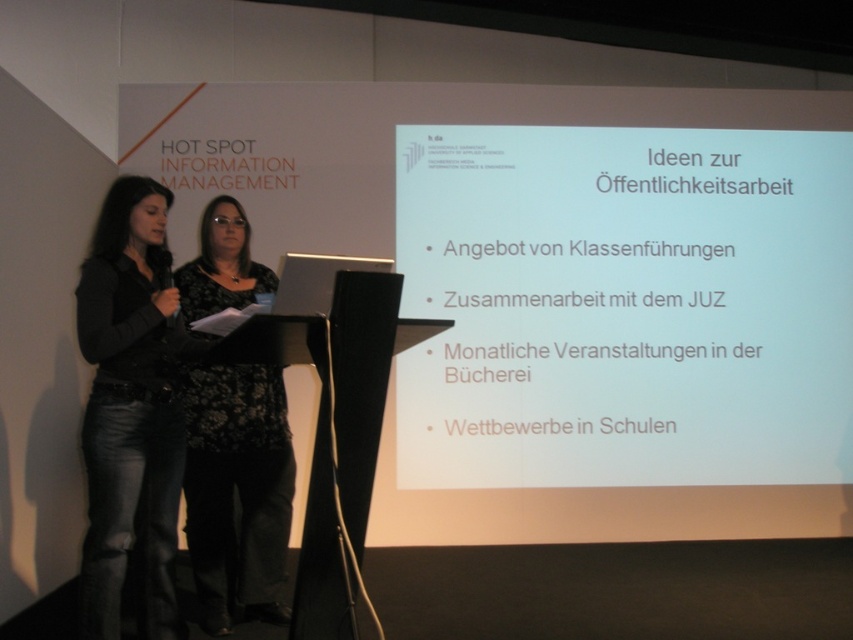
Question: From the image, what is the correct spatial relationship of white matte projector screen at upper center in relation to denim jeans at left?

Choices:
 (A) right
 (B) left

Answer: (A)

Question: Is denim jeans at left closer to camera compared to black floral dress at center?

Choices:
 (A) no
 (B) yes

Answer: (B)

Question: Among these points, which one is farthest from the camera?

Choices:
 (A) (218, 208)
 (B) (140, 516)
 (C) (437, 481)

Answer: (C)

Question: Among these objects, which one is farthest from the camera?

Choices:
 (A) denim jeans at left
 (B) white matte projector screen at upper center

Answer: (B)

Question: Does white matte projector screen at upper center appear over denim jeans at left?

Choices:
 (A) no
 (B) yes

Answer: (B)

Question: Which object is the closest to the white matte projector screen at upper center?

Choices:
 (A) denim jeans at left
 (B) black floral dress at center

Answer: (B)